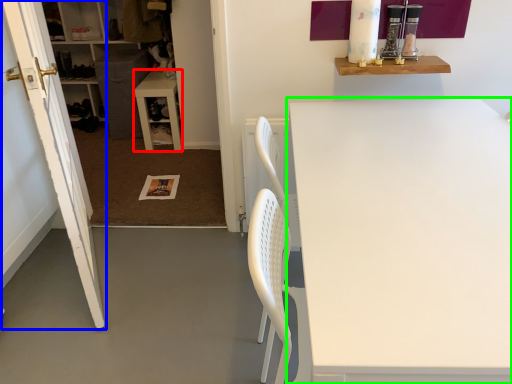
Question: Based on their relative distances, which object is farther from table (highlighted by a red box)? Choose from door (highlighted by a blue box) and table (highlighted by a green box).

Choices:
 (A) door
 (B) table

Answer: (B)